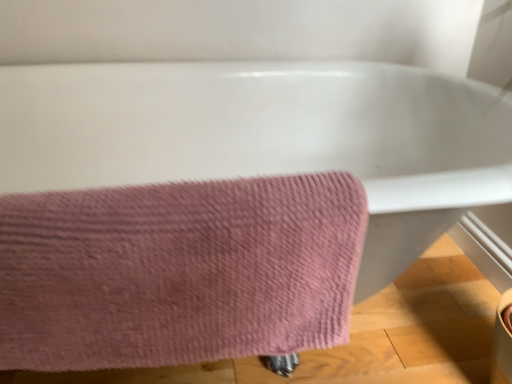
Question: Would you consider white glossy bathtub at upper center to be distant from pink textured towel at lower left?

Choices:
 (A) yes
 (B) no

Answer: (B)

Question: Is white glossy bathtub at upper center at the left side of pink textured towel at lower left?

Choices:
 (A) yes
 (B) no

Answer: (B)

Question: Can you confirm if white glossy bathtub at upper center is bigger than pink textured towel at lower left?

Choices:
 (A) yes
 (B) no

Answer: (A)

Question: Can you confirm if white glossy bathtub at upper center is smaller than pink textured towel at lower left?

Choices:
 (A) yes
 (B) no

Answer: (B)

Question: Considering the relative sizes of white glossy bathtub at upper center and pink textured towel at lower left in the image provided, is white glossy bathtub at upper center thinner than pink textured towel at lower left?

Choices:
 (A) yes
 (B) no

Answer: (B)

Question: From a real-world perspective, does white glossy bathtub at upper center stand above pink textured towel at lower left?

Choices:
 (A) no
 (B) yes

Answer: (A)

Question: Does pink textured towel at lower left have a greater width compared to white glossy bathtub at upper center?

Choices:
 (A) no
 (B) yes

Answer: (A)

Question: Is pink textured towel at lower left taller than white glossy bathtub at upper center?

Choices:
 (A) yes
 (B) no

Answer: (B)

Question: From the image's perspective, is pink textured towel at lower left located above white glossy bathtub at upper center?

Choices:
 (A) no
 (B) yes

Answer: (A)

Question: From the image's perspective, is pink textured towel at lower left under white glossy bathtub at upper center?

Choices:
 (A) no
 (B) yes

Answer: (B)

Question: Can you confirm if pink textured towel at lower left is smaller than white glossy bathtub at upper center?

Choices:
 (A) yes
 (B) no

Answer: (A)

Question: From a real-world perspective, is pink textured towel at lower left below white glossy bathtub at upper center?

Choices:
 (A) no
 (B) yes

Answer: (A)

Question: Looking at their shapes, would you say pink textured towel at lower left is wider or thinner than white glossy bathtub at upper center?

Choices:
 (A) thin
 (B) wide

Answer: (A)